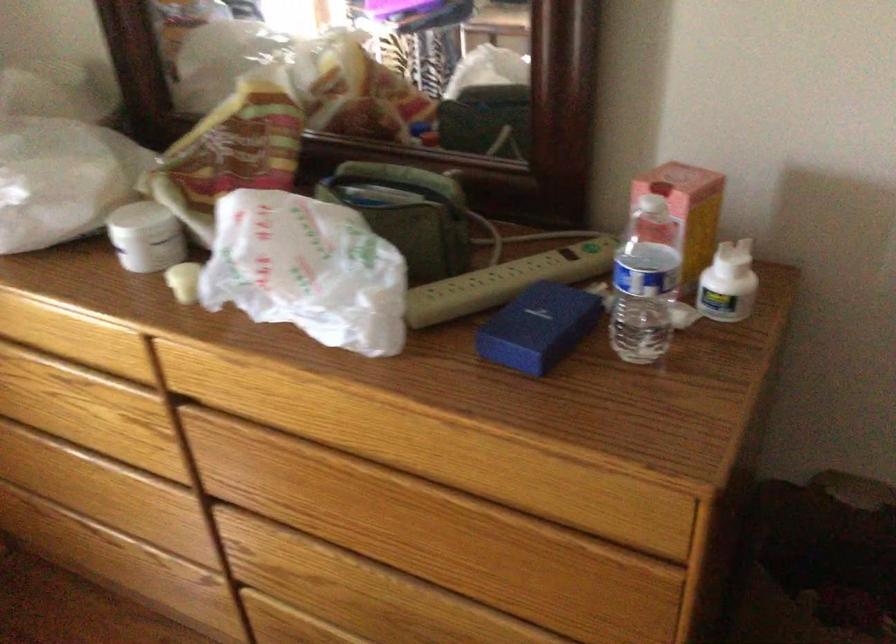
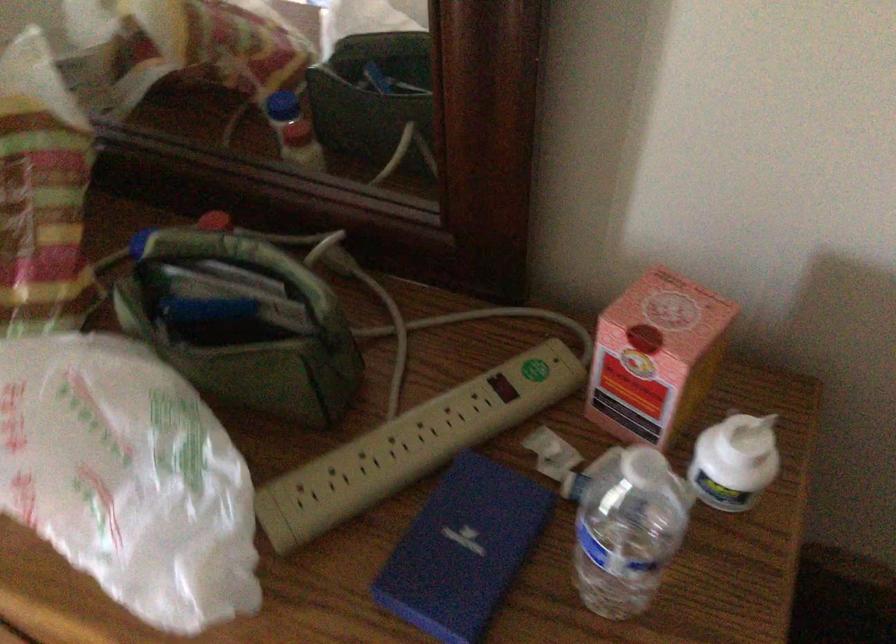
The point at [724,272] is marked in the first image. Where is the corresponding point in the second image?

(735, 462)